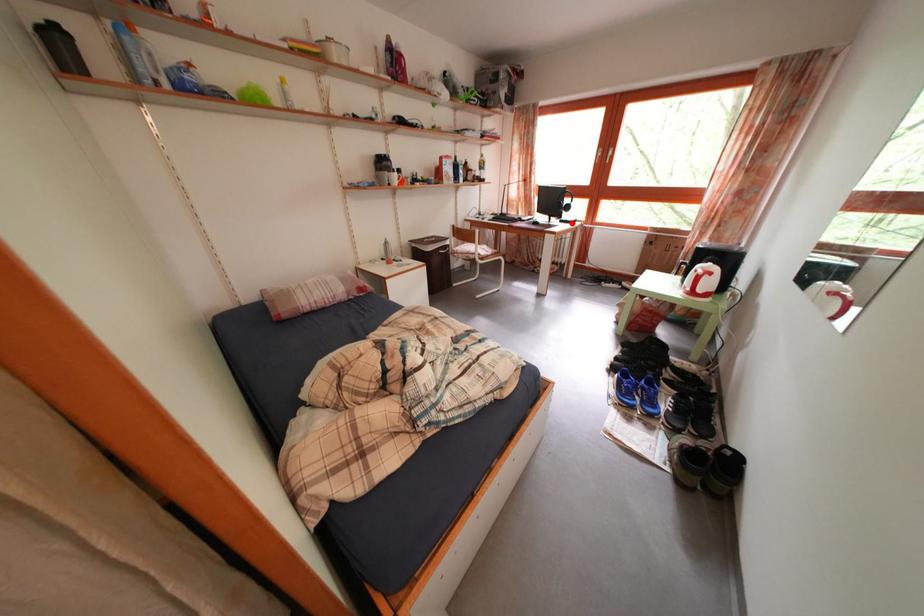
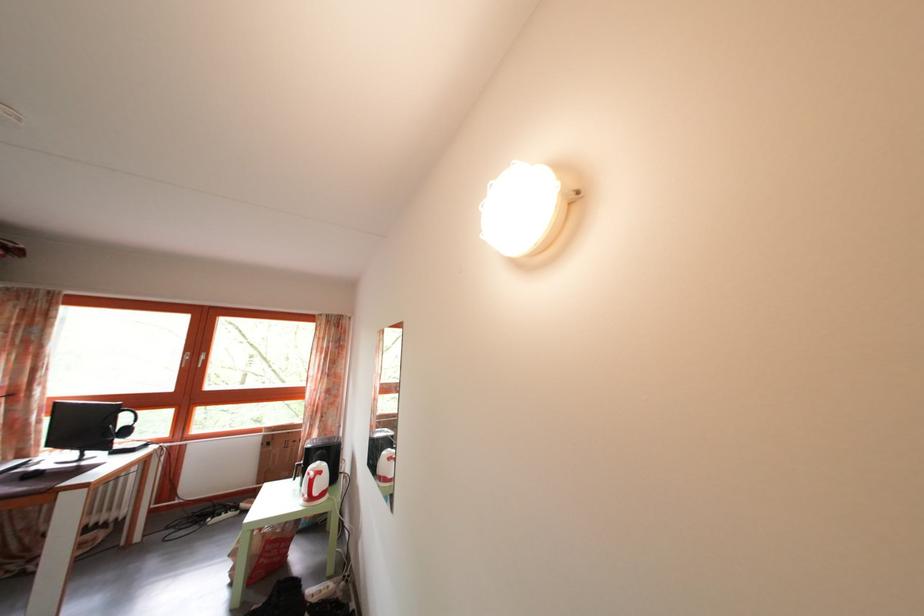
Where in the second image is the point corresponding to the highlighted location from the first image?

(128, 451)